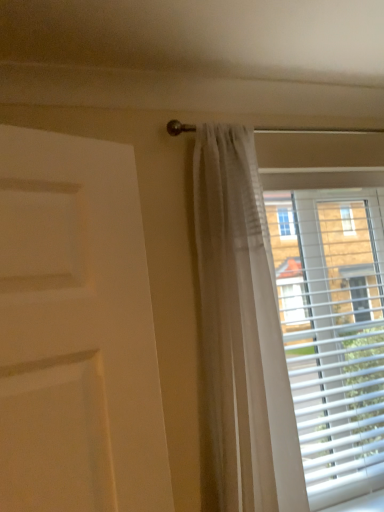
This screenshot has height=512, width=384. I want to click on sheer white curtain at upper center, so click(x=289, y=333).

What do you see at coordinates (289, 333) in the screenshot? I see `sheer white curtain at upper center` at bounding box center [289, 333].

Identify the location of sheer white curtain at upper center. (289, 333).